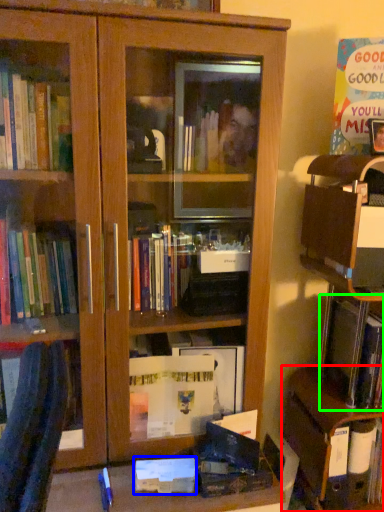
Question: Which object is the farthest from cabinetry (highlighted by a red box)? Choose among these: paperback book (highlighted by a blue box) or book (highlighted by a green box).

Choices:
 (A) paperback book
 (B) book

Answer: (A)